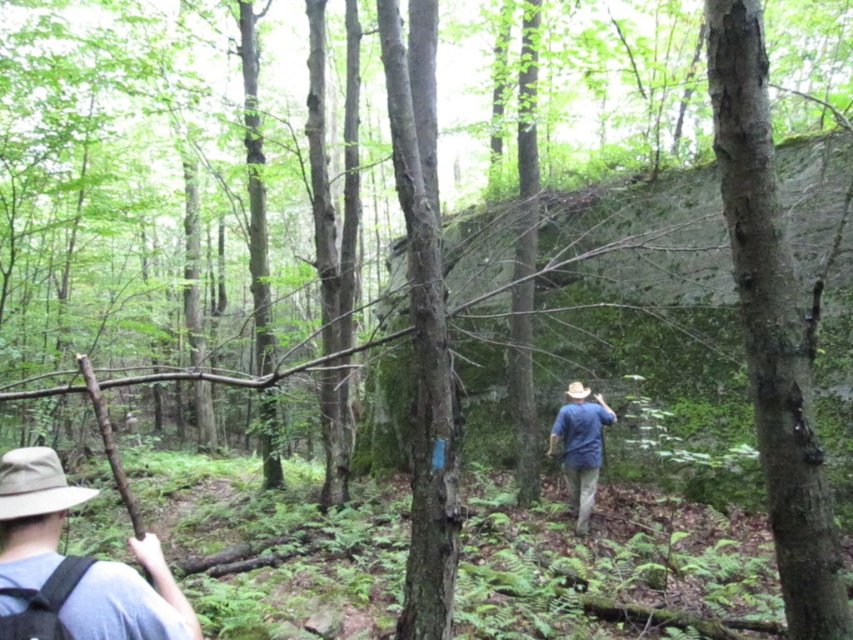
Question: Is gray fabric shirt at lower left to the right of blue denim shirt at center from the viewer's perspective?

Choices:
 (A) no
 (B) yes

Answer: (A)

Question: Does gray fabric shirt at lower left have a lesser width compared to blue denim shirt at center?

Choices:
 (A) no
 (B) yes

Answer: (B)

Question: Among these objects, which one is nearest to the camera?

Choices:
 (A) blue denim shirt at center
 (B) gray fabric shirt at lower left

Answer: (B)

Question: Estimate the real-world distances between objects in this image. Which object is farther from the gray fabric shirt at lower left?

Choices:
 (A) smooth bark tree at center-right
 (B) blue denim shirt at center

Answer: (B)

Question: Which object is the farthest from the smooth bark tree at center-right?

Choices:
 (A) gray fabric shirt at lower left
 (B) blue denim shirt at center

Answer: (B)

Question: Can you confirm if gray fabric shirt at lower left is bigger than blue denim shirt at center?

Choices:
 (A) no
 (B) yes

Answer: (A)